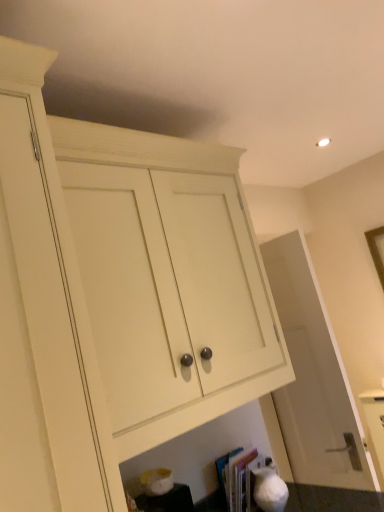
Question: Is hardcover book at lower center far from white matte door at center?

Choices:
 (A) no
 (B) yes

Answer: (A)

Question: Is hardcover book at lower center to the right of white matte door at center from the viewer's perspective?

Choices:
 (A) no
 (B) yes

Answer: (A)

Question: Is hardcover book at lower center positioned in front of white matte door at center?

Choices:
 (A) yes
 (B) no

Answer: (A)

Question: From a real-world perspective, is hardcover book at lower center located beneath white matte door at center?

Choices:
 (A) yes
 (B) no

Answer: (A)

Question: Would you say white matte door at center is part of hardcover book at lower center's contents?

Choices:
 (A) no
 (B) yes

Answer: (A)

Question: Considering the positions of point (198, 334) and point (231, 497), is point (198, 334) closer or farther from the camera than point (231, 497)?

Choices:
 (A) closer
 (B) farther

Answer: (A)

Question: From a real-world perspective, relative to hardcover book at lower center, is white wood cabinet at center vertically above or below?

Choices:
 (A) above
 (B) below

Answer: (A)

Question: Is white wood cabinet at center to the left or to the right of hardcover book at lower center in the image?

Choices:
 (A) right
 (B) left

Answer: (B)

Question: From the image's perspective, relative to hardcover book at lower center, is white wood cabinet at center above or below?

Choices:
 (A) above
 (B) below

Answer: (A)

Question: Considering the positions of hardcover book at lower center and white wood cabinet at center in the image, is hardcover book at lower center wider or thinner than white wood cabinet at center?

Choices:
 (A) thin
 (B) wide

Answer: (A)

Question: Considering the relative positions of hardcover book at lower center and white wood cabinet at center in the image provided, is hardcover book at lower center to the left or to the right of white wood cabinet at center?

Choices:
 (A) right
 (B) left

Answer: (A)

Question: Is hardcover book at lower center in front of or behind white wood cabinet at center in the image?

Choices:
 (A) front
 (B) behind

Answer: (B)

Question: From a real-world perspective, is hardcover book at lower center above or below white wood cabinet at center?

Choices:
 (A) above
 (B) below

Answer: (B)

Question: Looking at the image, does white wood cabinet at center seem bigger or smaller compared to white matte door at center?

Choices:
 (A) big
 (B) small

Answer: (A)

Question: In the image, is white wood cabinet at center on the left side or the right side of white matte door at center?

Choices:
 (A) right
 (B) left

Answer: (B)